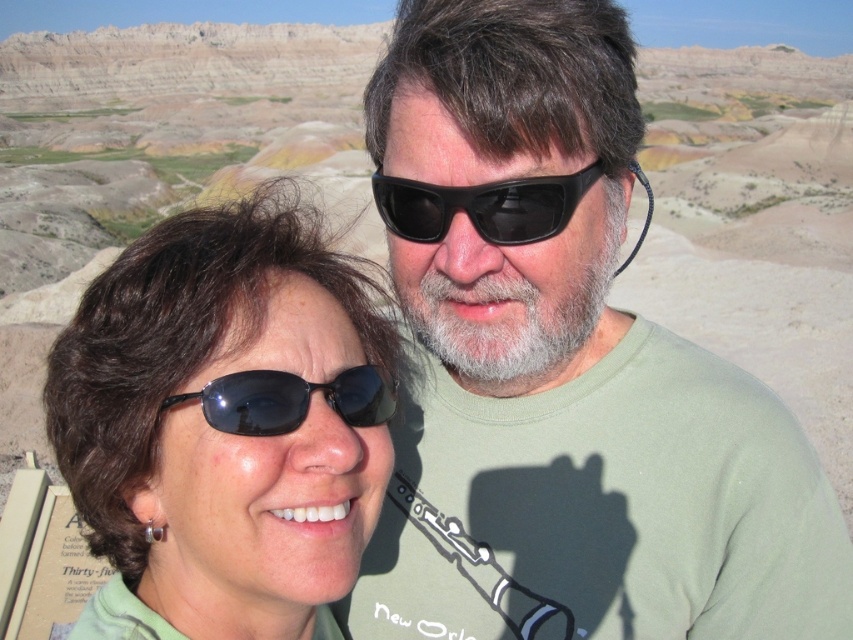
Which is above, matte green t-shirt at center or black reflective sunglasses at center?

matte green t-shirt at center is higher up.

In order to click on matte green t-shirt at center in this screenshot , I will do `click(564, 371)`.

Is point (618, 451) closer to camera compared to point (241, 397)?

No, it is behind (241, 397).

Where is `matte green t-shirt at center`? This screenshot has width=853, height=640. matte green t-shirt at center is located at coordinates (564, 371).

Which of these two, matte black sunglasses at left or black reflective sunglasses at center, stands shorter?

Standing shorter between the two is black reflective sunglasses at center.

Who is taller, matte black sunglasses at left or black reflective sunglasses at center?

Standing taller between the two is matte black sunglasses at left.

Between point (61, 387) and point (229, 404), which one is positioned in front?

Positioned in front is point (229, 404).

The width and height of the screenshot is (853, 640). I want to click on matte black sunglasses at left, so point(224,422).

Which is more to the left, black matte sunglasses at center or black reflective sunglasses at center?

black reflective sunglasses at center

Consider the image. Which of these two, black matte sunglasses at center or black reflective sunglasses at center, stands taller?

Standing taller between the two is black matte sunglasses at center.

Between point (555, 204) and point (207, 420), which one is positioned behind?

The point (555, 204) is behind.

Find the location of a particular element. black matte sunglasses at center is located at coordinates click(482, 205).